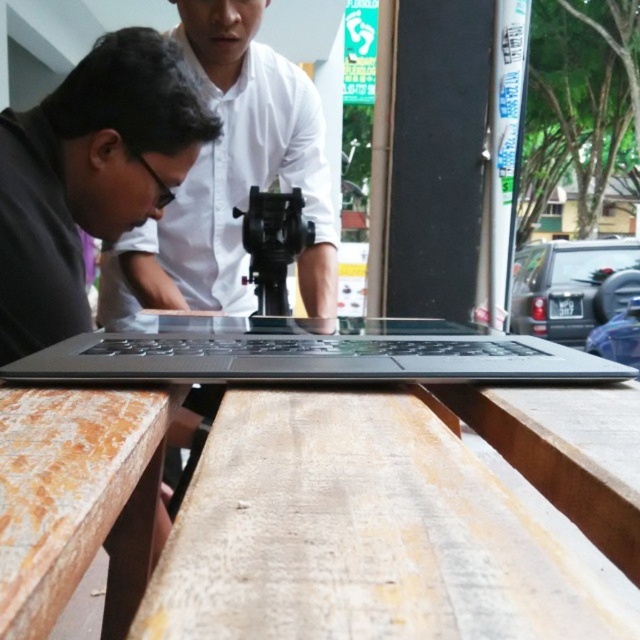
Question: Which point is farther to the camera?

Choices:
 (A) (369, 419)
 (B) (132, 504)

Answer: (B)

Question: Which point is closer to the camera taking this photo?

Choices:
 (A) (51, 506)
 (B) (300, 353)

Answer: (A)

Question: Which point is farther to the camera?

Choices:
 (A) sleek black laptop at center
 (B) wooden table at lower left
 (C) matte black laptop at center

Answer: (C)

Question: Does matte black laptop at center appear on the right side of wooden table at lower left?

Choices:
 (A) yes
 (B) no

Answer: (B)

Question: Observing the image, what is the correct spatial positioning of wooden table at center in reference to wooden table at lower left?

Choices:
 (A) right
 (B) left

Answer: (A)

Question: Is wooden table at lower left above sleek black laptop at center?

Choices:
 (A) yes
 (B) no

Answer: (B)